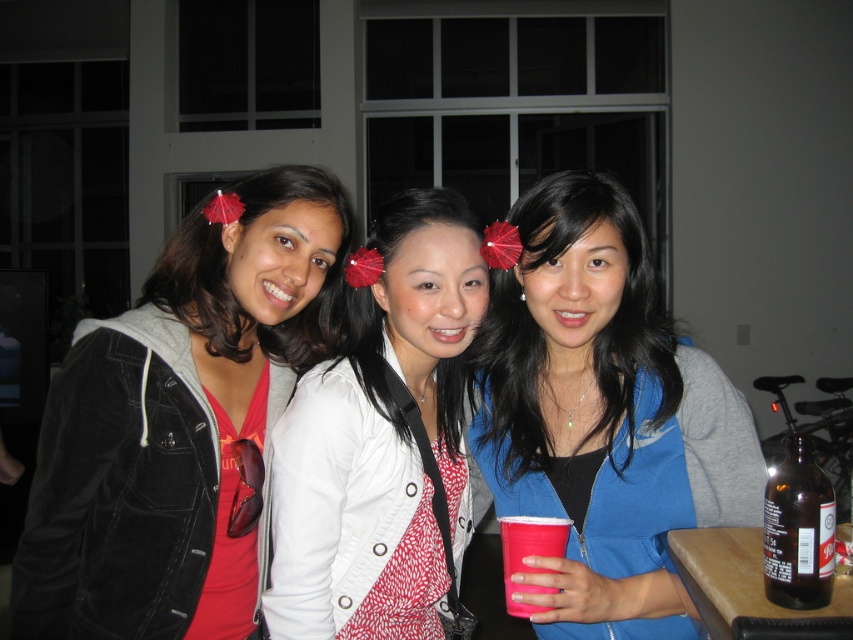
Question: Which of the following is the closest to the observer?

Choices:
 (A) pink plastic cup at center
 (B) matte black jacket at left

Answer: (A)

Question: Considering the relative positions of matte black jacket at left and pink plastic cup at center in the image provided, where is matte black jacket at left located with respect to pink plastic cup at center?

Choices:
 (A) below
 (B) above

Answer: (B)

Question: Can you confirm if white textured jacket at center is positioned to the right of brown glass bottle at lower right?

Choices:
 (A) no
 (B) yes

Answer: (A)

Question: Which point is farther to the camera?

Choices:
 (A) (799, 518)
 (B) (369, 561)
 (C) (531, 541)

Answer: (B)

Question: Among these points, which one is farthest from the camera?

Choices:
 (A) (531, 531)
 (B) (76, 449)

Answer: (B)

Question: Does blue zip-up jacket at center come in front of white textured jacket at center?

Choices:
 (A) yes
 (B) no

Answer: (A)